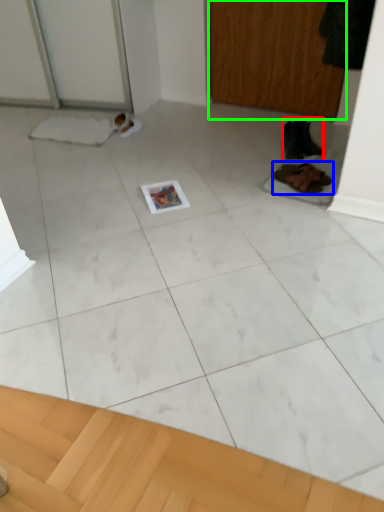
Question: Considering the real-world distances, which object is farthest from footwear (highlighted by a red box)? footwear (highlighted by a blue box) or screen door (highlighted by a green box)?

Choices:
 (A) footwear
 (B) screen door

Answer: (B)